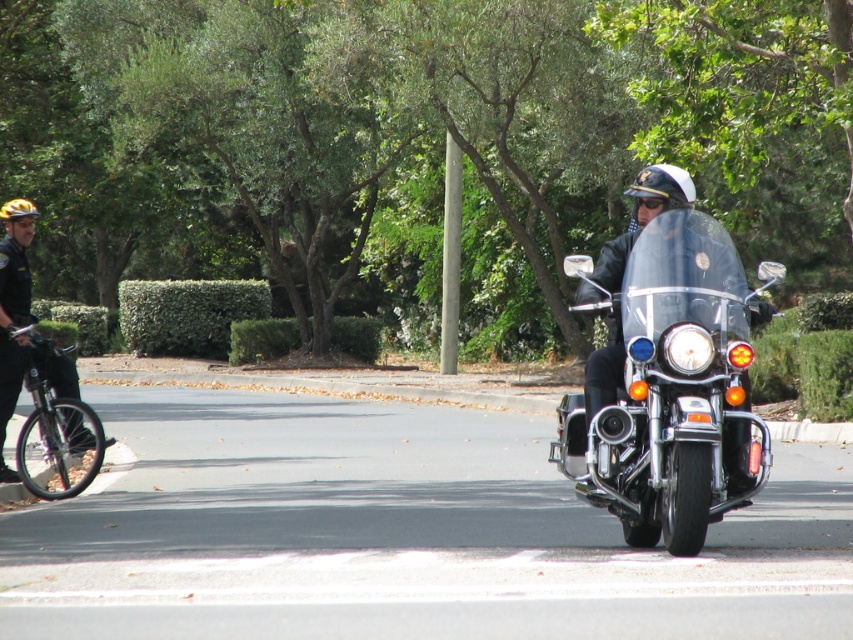
You are a traffic officer assessing the vehicles in the scene. Which vehicle, the black glossy motorcycle at center or the black matte bicycle at left, would require more space to maneuver in a tight area?

The black glossy motorcycle at center is larger in size than the black matte bicycle at left, so it would require more space to maneuver in a tight area.

You are a city planner analyzing traffic flow and need to determine if the black glossy motorcycle at center can fit through a narrow alley that the black matte bicycle at left can pass through. Based on their widths, what would you conclude?

The black glossy motorcycle at center is wider than the black matte bicycle at left, so it may not fit through the alley if the bicycle can just barely pass through.